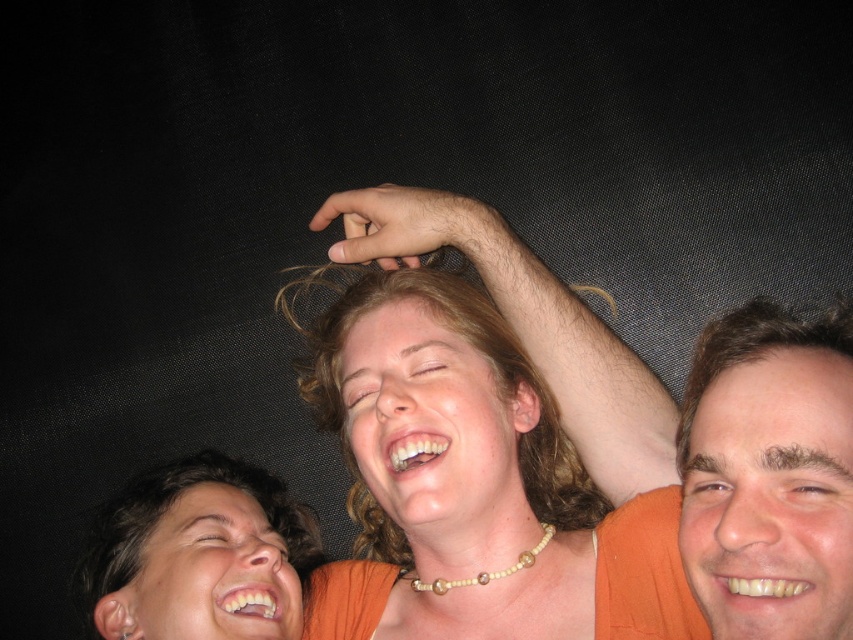
Does orange fabric shirt at center have a greater width compared to smooth skin face at upper right?

Indeed, orange fabric shirt at center has a greater width compared to smooth skin face at upper right.

Find the location of a particular element. The width and height of the screenshot is (853, 640). orange fabric shirt at center is located at coordinates (488, 442).